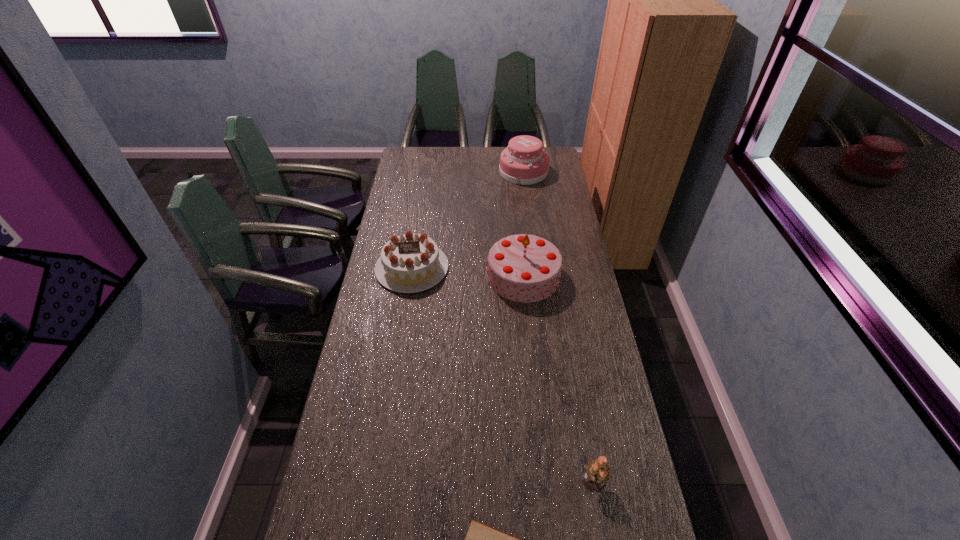
Locate an element on the screen. This screenshot has height=540, width=960. free space between the second shortest birthday cake and the tallest object is located at coordinates (523, 224).

In order to click on free area in between the tallest birthday cake and the candle holder in this screenshot , I will do point(559,378).

Image resolution: width=960 pixels, height=540 pixels. I want to click on empty space that is in between the shortest birthday cake and the second nearest object, so click(x=503, y=374).

Image resolution: width=960 pixels, height=540 pixels. Identify the location of vacant space in between the candle holder and the farthest object. (559, 326).

You are a GUI agent. You are given a task and a screenshot of the screen. Output one action in this format:
    pyautogui.click(x=<x>, y=<y>)
    Task: Click on the fourth closest object to the tallest birthday cake
    The width and height of the screenshot is (960, 540).
    Given the screenshot: What is the action you would take?
    pyautogui.click(x=481, y=539)

Find the location of a particular element. the second closest object relative to the candle holder is located at coordinates click(x=524, y=268).

You are a GUI agent. You are given a task and a screenshot of the screen. Output one action in this format:
    pyautogui.click(x=<x>, y=<y>)
    Task: Click on the birthday cake that can be found as the closest to the shortest birthday cake
    The width and height of the screenshot is (960, 540).
    Given the screenshot: What is the action you would take?
    pyautogui.click(x=524, y=268)

Where is `birthday cake that can be found as the closest to the nearest object`? birthday cake that can be found as the closest to the nearest object is located at coordinates (524, 268).

Locate an element on the screen. The image size is (960, 540). vacant space that satisfies the following two spatial constraints: 1. on the front side of the farthest object; 2. on the left side of the second nearest object is located at coordinates (564, 480).